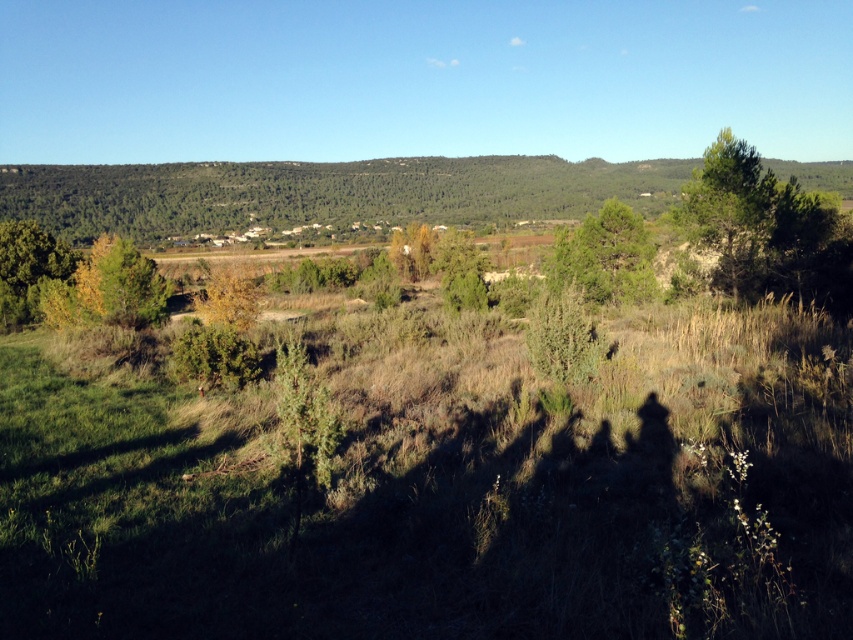
Does green textured tree at center have a greater width compared to green leafy tree at left?

Incorrect, green textured tree at center's width does not surpass green leafy tree at left's.

Consider the image. Which is above, green textured tree at center or green leafy tree at left?

Positioned higher is green textured tree at center.

Between point (593, 228) and point (33, 312), which one is positioned in front?

Point (33, 312) is in front.

What are the coordinates of `green textured tree at center` in the screenshot? It's located at (605, 257).

Who is lower down, green leafy bush at center or green leafy tree at left?

green leafy bush at center is lower down.

Is green leafy bush at center taller than green leafy tree at left?

No, green leafy bush at center is not taller than green leafy tree at left.

Does point (550, 312) lie in front of point (20, 280)?

That is True.

I want to click on green leafy bush at center, so coord(564,337).

From the picture: Does yellow-green leafy tree at center-left appear on the left side of green textured tree at center?

Yes, yellow-green leafy tree at center-left is to the left of green textured tree at center.

The width and height of the screenshot is (853, 640). Identify the location of yellow-green leafy tree at center-left. (107, 289).